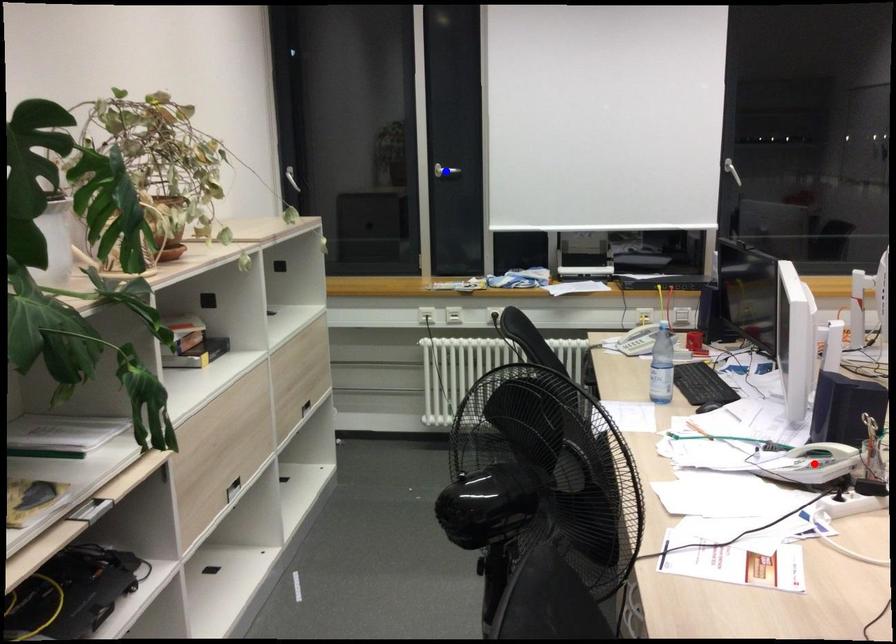
Question: Two points are marked on the image. Which point is closer to the camera?

Choices:
 (A) Blue point is closer.
 (B) Red point is closer.

Answer: (B)